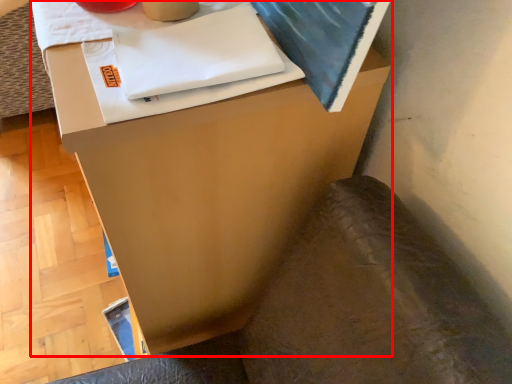
Question: Observing the image, what is the correct spatial positioning of furniture (annotated by the red box) in reference to swivel chair?

Choices:
 (A) right
 (B) left

Answer: (B)